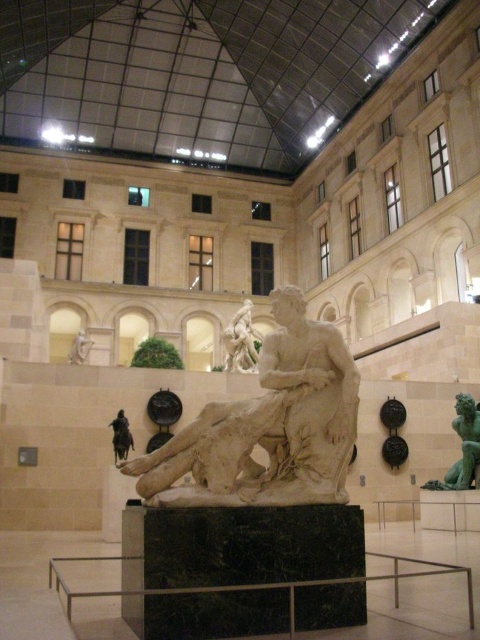
Image resolution: width=480 pixels, height=640 pixels. Describe the element at coordinates (463, 445) in the screenshot. I see `green patina statue at right` at that location.

Does green patina statue at right lie in front of white marble bust at upper left?

Yes, green patina statue at right is in front of white marble bust at upper left.

Is point (474, 422) farther from viewer compared to point (84, 339)?

No.

Image resolution: width=480 pixels, height=640 pixels. I want to click on green patina statue at right, so click(x=463, y=445).

Does point (443, 488) come farther from viewer compared to point (248, 369)?

No, (443, 488) is in front of (248, 369).

Who is more forward, (x=460, y=484) or (x=240, y=336)?

Point (x=460, y=484) is in front.

Find the location of `green patina statue at right`. green patina statue at right is located at coordinates (463, 445).

Where is `green patina statue at right`? green patina statue at right is located at coordinates (463, 445).

Between white marble statue at center and marble statue at center, which one has less height?

marble statue at center is shorter.

Who is positioned more to the left, white marble statue at center or marble statue at center?

Positioned to the left is white marble statue at center.

Where is `white marble statue at center`? The height and width of the screenshot is (640, 480). white marble statue at center is located at coordinates (267, 426).

The width and height of the screenshot is (480, 640). What are the coordinates of `white marble statue at center` in the screenshot? It's located at (267, 426).